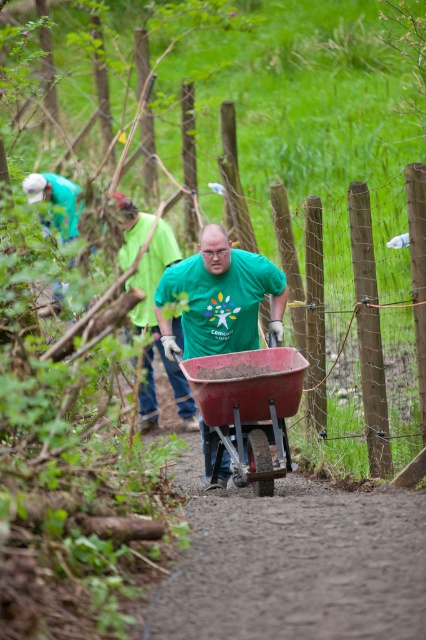
Question: Among these objects, which one is farthest from the camera?

Choices:
 (A) matte red wheelbarrow at center
 (B) matte green shirt at center

Answer: (B)

Question: Observing the image, what is the correct spatial positioning of matte green shirt at center in reference to green matte shirt at center?

Choices:
 (A) right
 (B) left

Answer: (A)

Question: Which object appears farthest from the camera in this image?

Choices:
 (A) green matte shirt at center
 (B) matte red wheelbarrow at center

Answer: (A)

Question: Is matte red wheelbarrow at center wider than matte green shirt at center?

Choices:
 (A) yes
 (B) no

Answer: (B)

Question: Is matte red wheelbarrow at center below matte green shirt at center?

Choices:
 (A) yes
 (B) no

Answer: (A)

Question: Which of the following is the closest to the observer?

Choices:
 (A) (216, 458)
 (B) (146, 221)

Answer: (A)